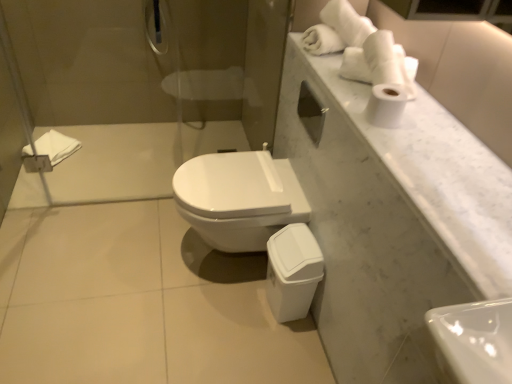
Question: Considering the relative sizes of white matte toilet paper at upper right and white glossy toilet at center in the image provided, is white matte toilet paper at upper right taller than white glossy toilet at center?

Choices:
 (A) yes
 (B) no

Answer: (B)

Question: Is white matte toilet paper at upper right facing away from white glossy toilet at center?

Choices:
 (A) no
 (B) yes

Answer: (A)

Question: From a real-world perspective, is white matte toilet paper at upper right over white glossy toilet at center?

Choices:
 (A) no
 (B) yes

Answer: (B)

Question: Can white glossy toilet at center be found inside white matte toilet paper at upper right?

Choices:
 (A) yes
 (B) no

Answer: (B)

Question: Can you confirm if white matte toilet paper at upper right is smaller than white glossy toilet at center?

Choices:
 (A) yes
 (B) no

Answer: (A)

Question: Is white matte toilet paper at upper right in front of or behind white soft towel at left in the image?

Choices:
 (A) front
 (B) behind

Answer: (A)

Question: Do you think white matte toilet paper at upper right is within white soft towel at left, or outside of it?

Choices:
 (A) outside
 (B) inside

Answer: (A)

Question: Is white matte toilet paper at upper right taller or shorter than white soft towel at left?

Choices:
 (A) short
 (B) tall

Answer: (B)

Question: From the image's perspective, is white matte toilet paper at upper right positioned above or below white soft towel at left?

Choices:
 (A) below
 (B) above

Answer: (A)

Question: Looking at their shapes, would you say white glossy toilet at center is wider or thinner than white soft towel at left?

Choices:
 (A) thin
 (B) wide

Answer: (B)

Question: Looking at the image, does white glossy toilet at center seem bigger or smaller compared to white soft towel at left?

Choices:
 (A) small
 (B) big

Answer: (B)

Question: Considering the positions of point (293, 200) and point (53, 148), is point (293, 200) closer or farther from the camera than point (53, 148)?

Choices:
 (A) closer
 (B) farther

Answer: (A)

Question: From a real-world perspective, is white glossy toilet at center physically located above or below white soft towel at left?

Choices:
 (A) below
 (B) above

Answer: (B)

Question: Does point (51, 147) appear closer or farther from the camera than point (346, 109)?

Choices:
 (A) closer
 (B) farther

Answer: (B)

Question: From the image's perspective, is white soft towel at left above or below white marble countertop at upper right?

Choices:
 (A) above
 (B) below

Answer: (A)